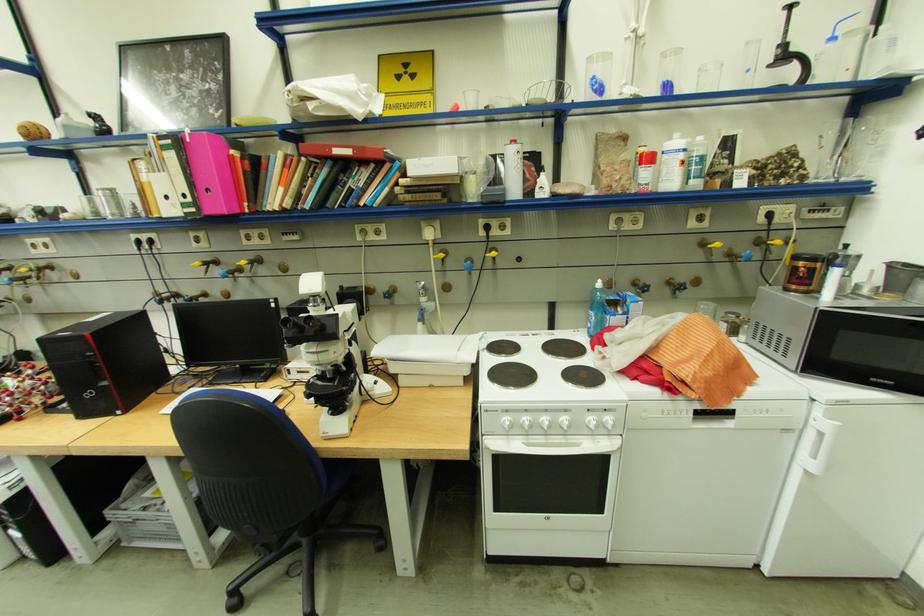
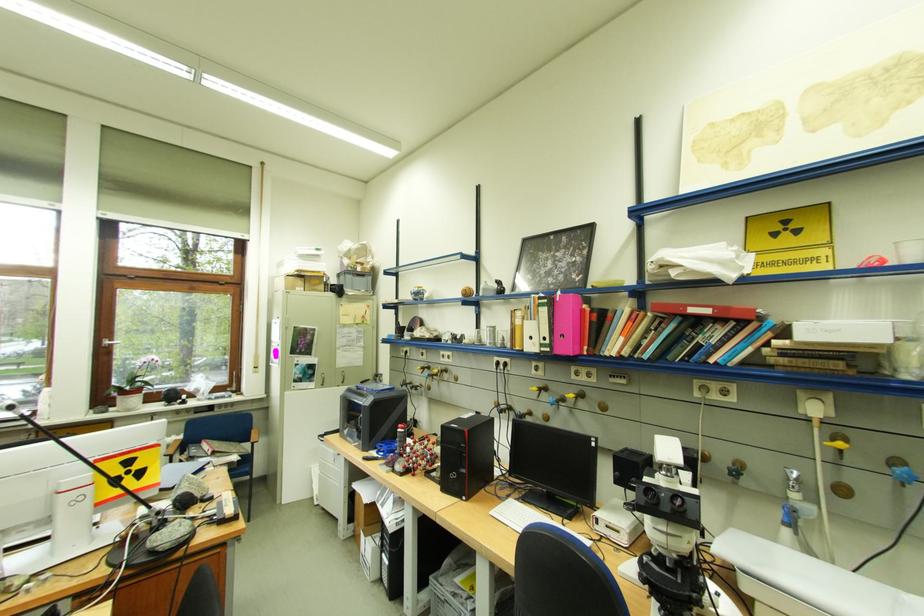
In the second image, find the point that corresponds to (258,261) in the first image.

(585, 395)